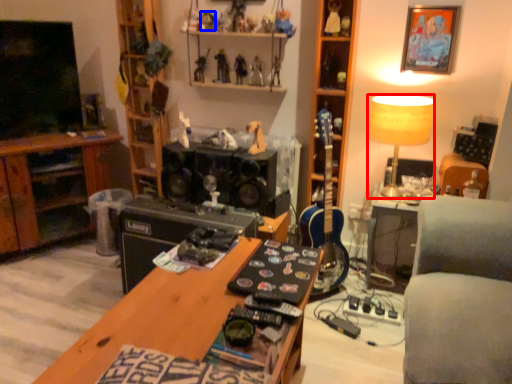
Question: Which object appears farthest to the camera in this image, lamp (highlighted by a red box) or toy (highlighted by a blue box)?

Choices:
 (A) lamp
 (B) toy

Answer: (B)